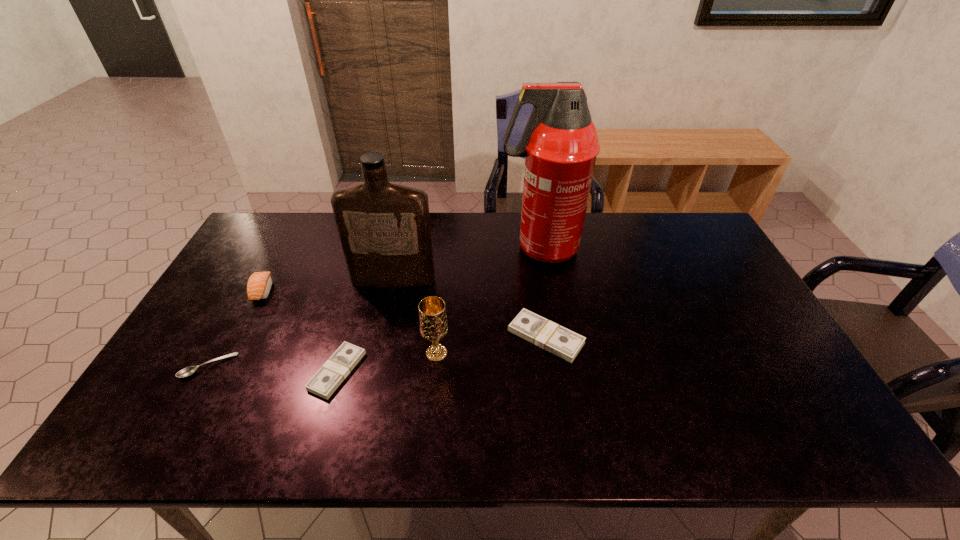
Given the evenly spaced dollars in the image, where should an extra dollar be added on the right to preserve the spacing? Please point to a vacant space. Please provide its 2D coordinates. Your answer should be formatted as a tuple, i.e. [(x, y)], where the tuple contains the x and y coordinates of a point satisfying the conditions above.

[(728, 307)]